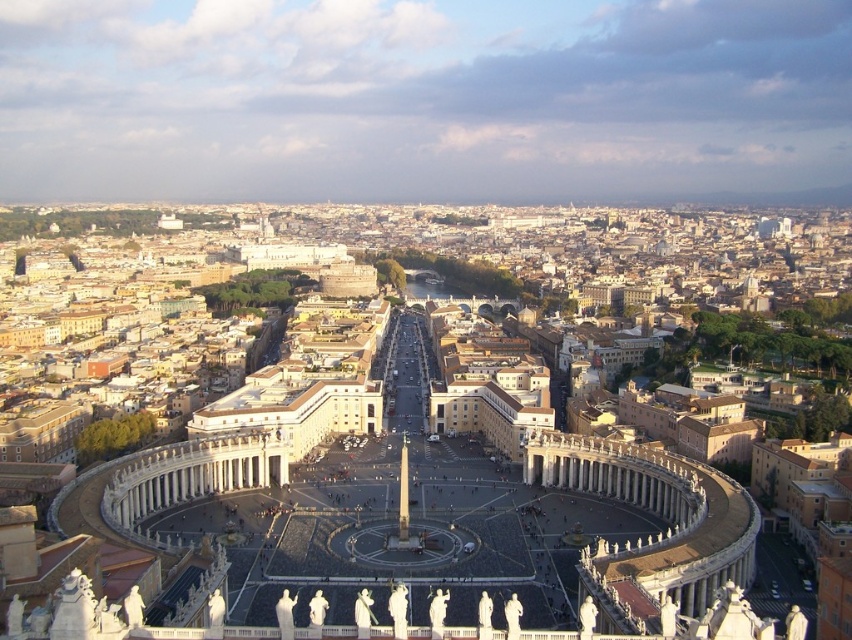
Does white marble palace at center appear over white marble pillar at center?

Correct, white marble palace at center is located above white marble pillar at center.

Measure the distance between point (x=505, y=465) and camera.

They are 178.42 meters apart.

Image resolution: width=852 pixels, height=640 pixels. I want to click on white marble palace at center, so click(459, 477).

What are the coordinates of `white marble palace at center` in the screenshot? It's located at (459, 477).